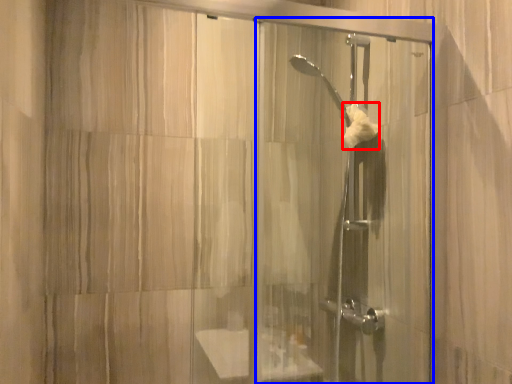
Question: Which of the following is the closest to the observer, hand towel (highlighted by a red box) or screen door (highlighted by a blue box)?

Choices:
 (A) hand towel
 (B) screen door

Answer: (B)